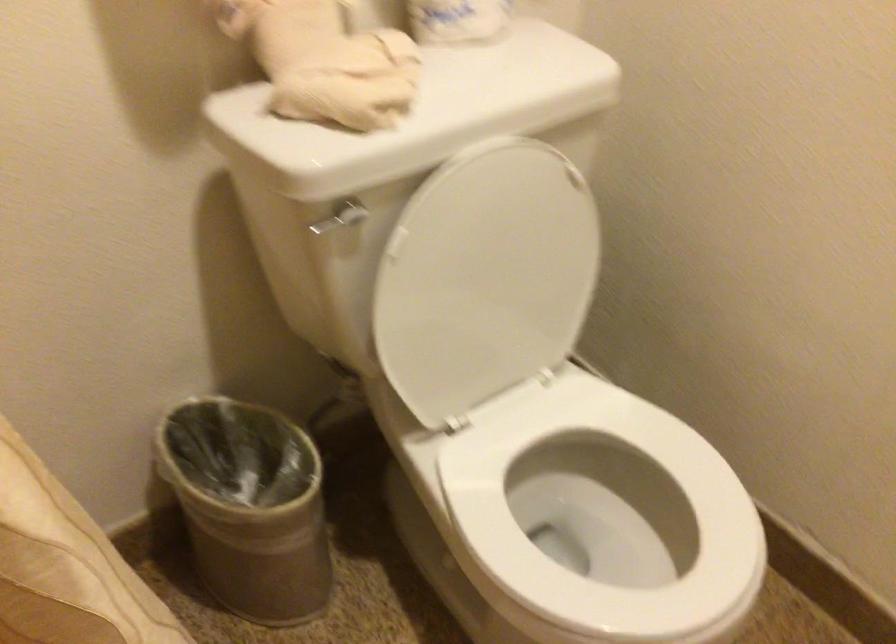
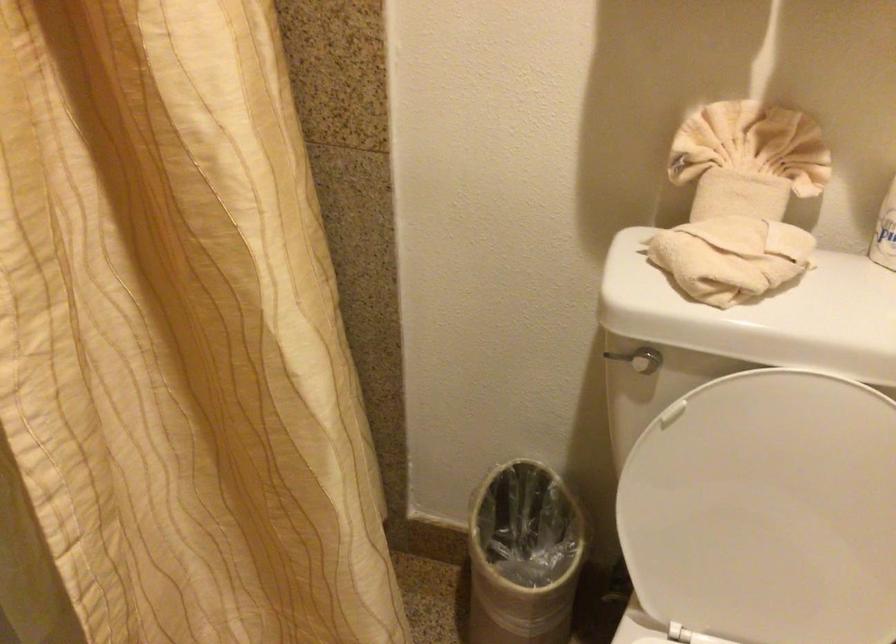
Find the pixel in the second image that matches (320,222) in the first image.

(616, 357)